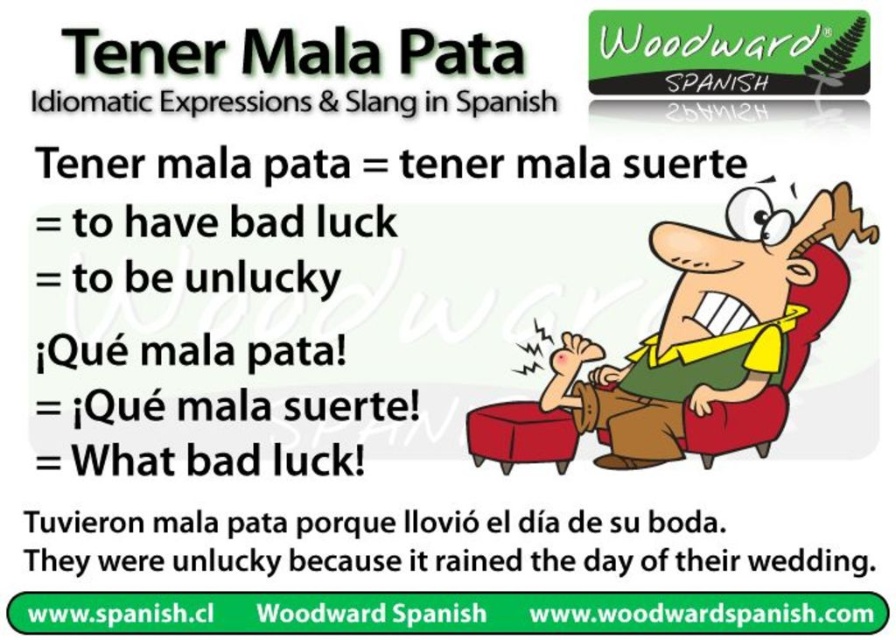
Is white paper text at center positioned in front of green metallic text at upper center?

Yes, it is in front of green metallic text at upper center.

Can you confirm if white paper text at center is smaller than green metallic text at upper center?

No.

Is point (343, 556) farther from camera compared to point (339, 42)?

Yes.

Identify the location of white paper text at center. (757, 561).

Is green fabric shirt at upper right thinner than green metallic text at upper center?

Yes.

Which is in front, point (670, 380) or point (85, 51)?

Point (85, 51)

Find the location of a particular element. green fabric shirt at upper right is located at coordinates (716, 337).

From the picture: Does green metallic text at upper center lie behind white paper at upper center?

Yes, green metallic text at upper center is behind white paper at upper center.

Does point (125, 51) come behind point (171, 108)?

That is False.

Image resolution: width=896 pixels, height=640 pixels. Describe the element at coordinates (308, 54) in the screenshot. I see `green metallic text at upper center` at that location.

Identify the location of green metallic text at upper center. (308, 54).